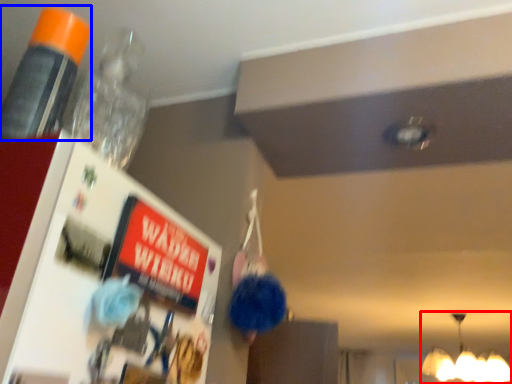
Question: Which of the following is the closest to the observer, lamp (highlighted by a red box) or bottle (highlighted by a blue box)?

Choices:
 (A) lamp
 (B) bottle

Answer: (B)